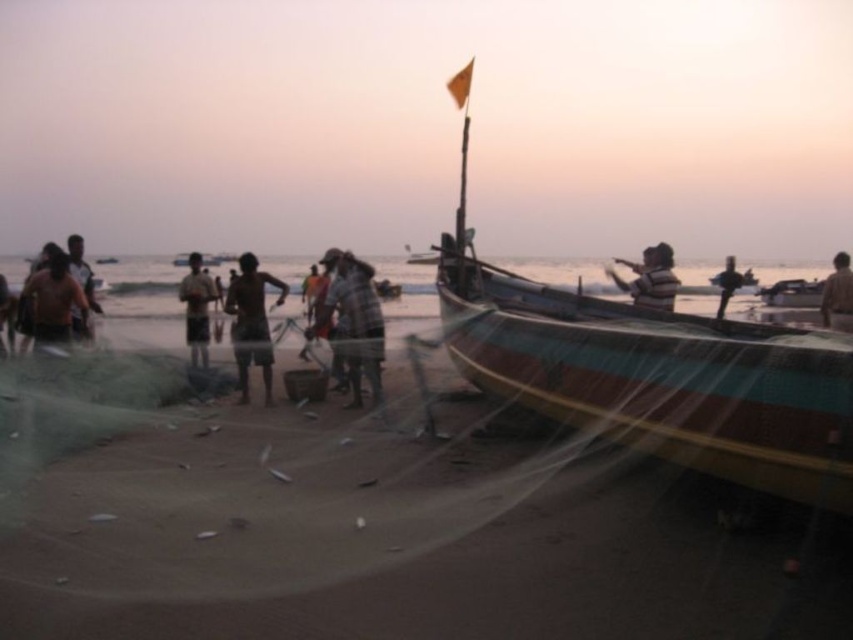
Question: Which object is the closest to the checkered fabric shirt at center?

Choices:
 (A) dark skin human at center
 (B) light brown fabric shirt at center

Answer: (A)

Question: Can you confirm if translucent netting at center is smaller than light brown fabric shirt at center?

Choices:
 (A) yes
 (B) no

Answer: (A)

Question: Which object appears farthest from the camera in this image?

Choices:
 (A) wooden boat at center
 (B) dark skin human at center
 (C) checkered fabric shirt at center

Answer: (B)

Question: Does wooden boat at center have a larger size compared to dark skin human at center?

Choices:
 (A) no
 (B) yes

Answer: (B)

Question: From the image, what is the correct spatial relationship of translucent netting at center in relation to dark skin human at center?

Choices:
 (A) left
 (B) right

Answer: (B)

Question: Among these points, which one is nearest to the camera?

Choices:
 (A) pos(247,330)
 (B) pos(329,632)

Answer: (B)